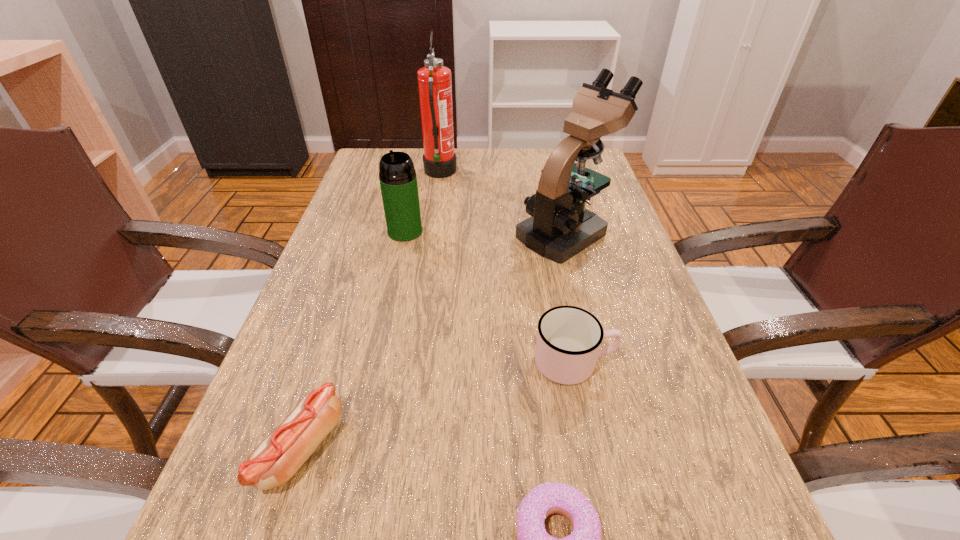
Where is `fire extinguisher`? fire extinguisher is located at coordinates (434, 80).

I want to click on microscope, so (x=560, y=227).

Where is `thermos bottle`? thermos bottle is located at coordinates (398, 181).

Find the location of `the fourth farthest object`. the fourth farthest object is located at coordinates (568, 341).

The image size is (960, 540). What are the coordinates of `the fourth tallest object` in the screenshot? It's located at (568, 341).

Locate an element on the screen. The height and width of the screenshot is (540, 960). sausage is located at coordinates (278, 457).

The width and height of the screenshot is (960, 540). Find the location of `free space located on the front-facing side of the fire extinguisher`. free space located on the front-facing side of the fire extinguisher is located at coordinates (473, 173).

Locate an element on the screen. The width and height of the screenshot is (960, 540). vacant space located on the left of the microscope is located at coordinates (373, 233).

The image size is (960, 540). In order to click on free location located 0.090m from the spout of the thermos bottle in this screenshot , I will do `click(397, 266)`.

Locate an element on the screen. blank area located on the side of the mug with the handle is located at coordinates (675, 362).